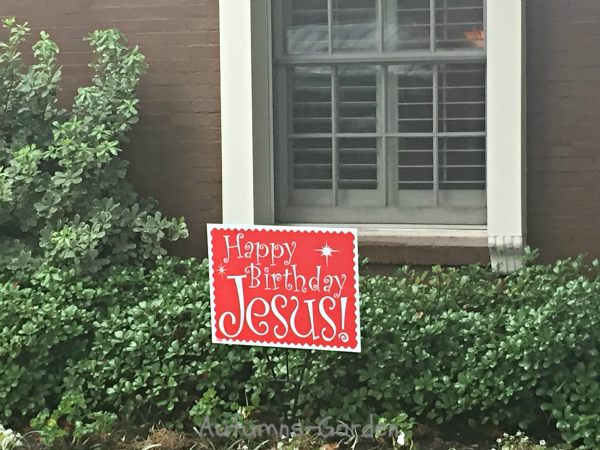
Where is `window frame`? This screenshot has width=600, height=450. window frame is located at coordinates (241, 123).